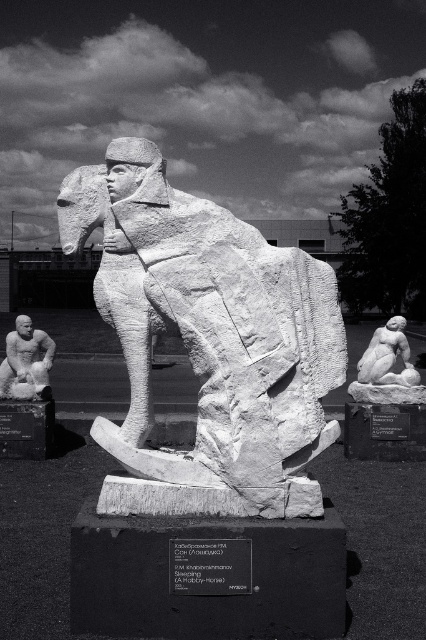
Question: Does white stone horse at center appear over white marble reclining figure at lower right?

Choices:
 (A) no
 (B) yes

Answer: (B)

Question: Which point is farther to the camera?

Choices:
 (A) smooth stone man at center
 (B) white stone horse at center
 (C) white marble reclining figure at lower right

Answer: (A)

Question: Which object appears closest to the camera in this image?

Choices:
 (A) white marble reclining figure at lower right
 (B) smooth stone man at center

Answer: (A)

Question: Is white stone horse at center positioned before smooth stone man at center?

Choices:
 (A) no
 (B) yes

Answer: (B)

Question: Is white stone horse at center thinner than smooth stone man at center?

Choices:
 (A) no
 (B) yes

Answer: (A)

Question: Which point is farther from the camera taking this photo?

Choices:
 (A) (166, 244)
 (B) (48, 340)
 (C) (402, 381)

Answer: (B)